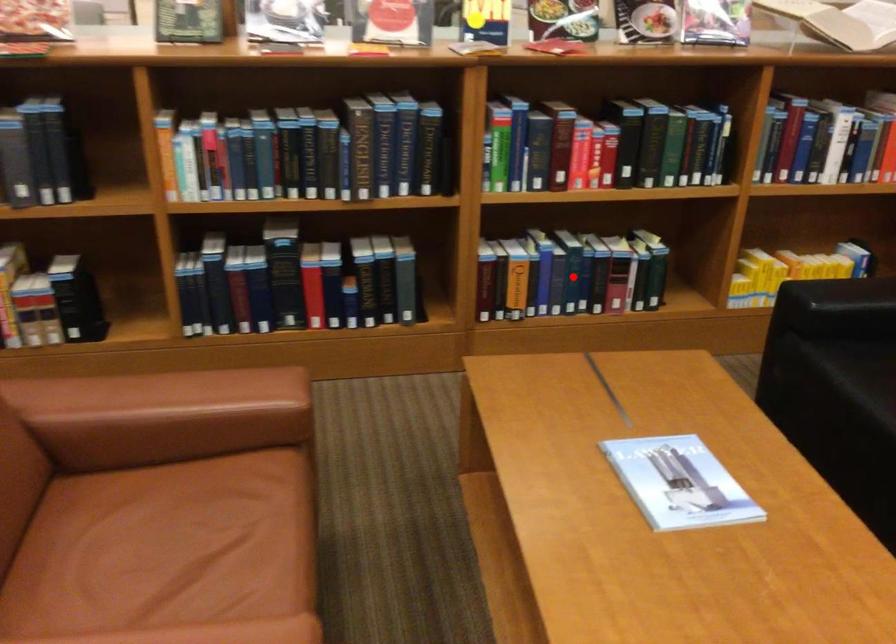
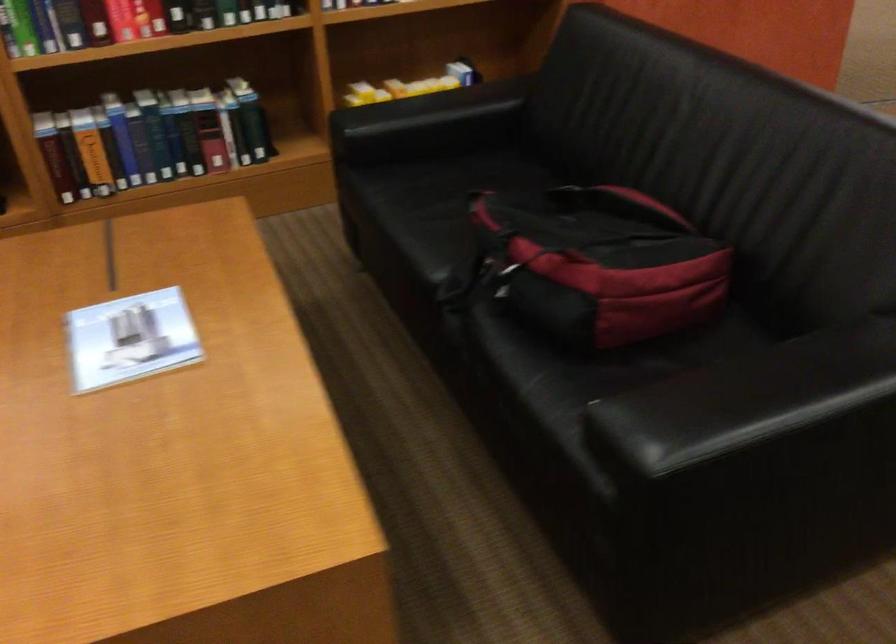
The point at the highlighted location is marked in the first image. Where is the corresponding point in the second image?

(151, 138)